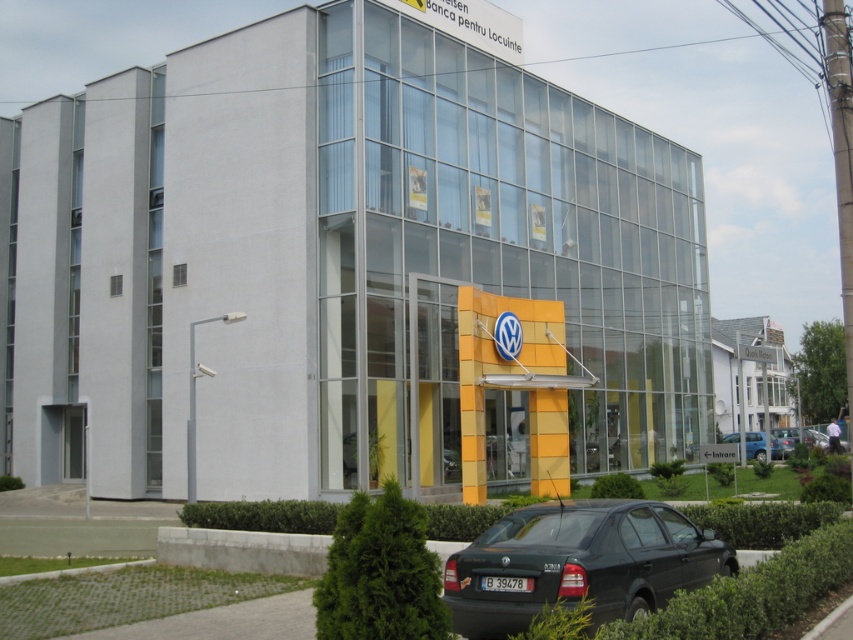
Describe the element at coordinates (578, 563) in the screenshot. I see `black matte sedan at lower center` at that location.

I want to click on black matte sedan at lower center, so click(x=578, y=563).

Who is lower down, black matte sedan at lower center or blue metallic car at lower right?

blue metallic car at lower right is below.

Consider the image. Is black matte sedan at lower center below blue metallic car at lower right?

Incorrect, black matte sedan at lower center is not positioned below blue metallic car at lower right.

Does point (589, 529) lie in front of point (781, 449)?

Yes.

The image size is (853, 640). Find the location of `black matte sedan at lower center`. black matte sedan at lower center is located at coordinates (578, 563).

Can you confirm if blue metallic car at lower right is positioned to the left of metallic silver sedan at lower right?

Indeed, blue metallic car at lower right is positioned on the left side of metallic silver sedan at lower right.

Is blue metallic car at lower right taller than metallic silver sedan at lower right?

Correct, blue metallic car at lower right is much taller as metallic silver sedan at lower right.

Identify the location of blue metallic car at lower right. Image resolution: width=853 pixels, height=640 pixels. (755, 445).